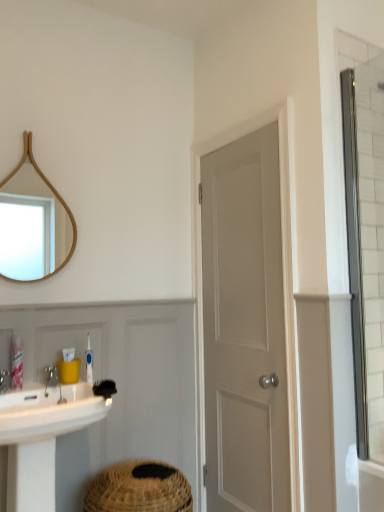
The width and height of the screenshot is (384, 512). What are the coordinates of `silver metallic faucet at lower left` in the screenshot? It's located at (5, 381).

What is the approximate height of black bristle brush at lower center?

The height of black bristle brush at lower center is 1.55 inches.

How much space does yellow plastic container at sink, which is counted as the second toiletry, starting from the right, occupy vertically?

5.85 inches.

Where is `clear glass shower door at right`? The height and width of the screenshot is (512, 384). clear glass shower door at right is located at coordinates (355, 258).

Image resolution: width=384 pixels, height=512 pixels. Describe the element at coordinates (89, 362) in the screenshot. I see `blue plastic toothbrush at lower left, acting as the first toiletry starting from the right` at that location.

The image size is (384, 512). I want to click on silver metallic faucet at lower left, so [5, 381].

Which of these two, wooden mirror at upper left or silver metallic faucet at lower left, is bigger?

With larger size is wooden mirror at upper left.

Which object is wider, wooden mirror at upper left or silver metallic faucet at lower left?

silver metallic faucet at lower left.

Is wooden mirror at upper left surrounding silver metallic faucet at lower left?

No, silver metallic faucet at lower left is not inside wooden mirror at upper left.

How different are the orientations of wooden mirror at upper left and silver metallic faucet at lower left in degrees?

The facing directions of wooden mirror at upper left and silver metallic faucet at lower left are 0.404 degrees apart.

Would you say black bristle brush at lower center is a long distance from white glossy sink at lower left?

No, black bristle brush at lower center is not far away from white glossy sink at lower left.

From the image's perspective, is black bristle brush at lower center above white glossy sink at lower left?

Correct, black bristle brush at lower center appears higher than white glossy sink at lower left in the image.

From the picture: Is white glossy sink at lower left completely or partially inside black bristle brush at lower center?

No, white glossy sink at lower left is not surrounded by black bristle brush at lower center.

Are pink plastic tube at lower left, which is the 1th toiletry from left to right, and blue plastic toothbrush at lower left, acting as the first toiletry starting from the right, beside each other?

Answer: pink plastic tube at lower left, which is the 1th toiletry from left to right, and blue plastic toothbrush at lower left, acting as the first toiletry starting from the right, are not in contact.

Which object is positioned more to the left, pink plastic tube at lower left, positioned as the third toiletry in right-to-left order, or blue plastic toothbrush at lower left, acting as the third toiletry starting from the left?

From the viewer's perspective, pink plastic tube at lower left, positioned as the third toiletry in right-to-left order, appears more on the left side.

From a real-world perspective, is pink plastic tube at lower left, which is the 1th toiletry from left to right, physically below blue plastic toothbrush at lower left, acting as the third toiletry starting from the left?

Yes.

What's the angular difference between pink plastic tube at lower left, which is the 1th toiletry from left to right, and clear glass shower door at right's facing directions?

The angular difference between pink plastic tube at lower left, which is the 1th toiletry from left to right, and clear glass shower door at right is 90 degrees.

How far apart are pink plastic tube at lower left, positioned as the third toiletry in right-to-left order, and clear glass shower door at right?

pink plastic tube at lower left, positioned as the third toiletry in right-to-left order, and clear glass shower door at right are 1.44 meters apart from each other.

From the image's perspective, which object appears higher, pink plastic tube at lower left, which is the 1th toiletry from left to right, or clear glass shower door at right?

clear glass shower door at right is shown above in the image.

Is pink plastic tube at lower left, positioned as the third toiletry in right-to-left order, facing towards clear glass shower door at right?

No, pink plastic tube at lower left, positioned as the third toiletry in right-to-left order, is not oriented towards clear glass shower door at right.

From the image's perspective, is white glossy sink at lower left on top of yellow plastic container at sink, which is counted as the second toiletry, starting from the right?

Actually, white glossy sink at lower left appears below yellow plastic container at sink, which is counted as the second toiletry, starting from the right, in the image.

How distant is white glossy sink at lower left from yellow plastic container at sink, which is counted as the second toiletry, starting from the right?

white glossy sink at lower left and yellow plastic container at sink, which is counted as the second toiletry, starting from the right, are 11.58 inches apart from each other.

From a real-world perspective, is white glossy sink at lower left positioned above or below yellow plastic container at sink, which is counted as the second toiletry, starting from the right?

Clearly, from a real-world perspective, white glossy sink at lower left is below yellow plastic container at sink, which is counted as the second toiletry, starting from the right.

Are white glossy sink at lower left and yellow plastic container at sink, the 2th toiletry from the left, far apart?

They are positioned close to each other.

Does point (170, 466) come behind point (14, 480)?

Yes, it is.

Does brown woven basket at lower center have a lesser height compared to white glossy sink at lower left?

Yes, brown woven basket at lower center is shorter than white glossy sink at lower left.

Is brown woven basket at lower center positioned beyond the bounds of white glossy sink at lower left?

Yes, brown woven basket at lower center is located beyond the bounds of white glossy sink at lower left.

Is brown woven basket at lower center oriented towards white glossy sink at lower left?

No.

Is black bristle brush at lower center not inside white matte door at center?

Indeed, black bristle brush at lower center is completely outside white matte door at center.

What's the angular difference between black bristle brush at lower center and white matte door at center's facing directions?

75.7 degrees.

Could you tell me if black bristle brush at lower center is turned towards white matte door at center?

No.

Does black bristle brush at lower center have a greater height compared to white matte door at center?

No.

Locate an element on the screen. The width and height of the screenshot is (384, 512). mirror above the silver metallic faucet at lower left (from the image's perspective) is located at coordinates (54, 207).

This screenshot has height=512, width=384. What are the coordinates of `brush above the white glossy sink at lower left (from a real-world perspective)` in the screenshot? It's located at (104, 388).

From the image, which object appears to be nearer to black bristle brush at lower center, silver metallic faucet at lower left or brown woven basket at lower center?

silver metallic faucet at lower left is closer to black bristle brush at lower center.

When comparing their distances from black bristle brush at lower center, does yellow plastic container at sink, the 2th toiletry from the left, or silver metallic faucet at lower left seem closer?

Based on the image, yellow plastic container at sink, the 2th toiletry from the left, appears to be nearer to black bristle brush at lower center.

From the image, which object appears to be nearer to black bristle brush at lower center, blue plastic toothbrush at lower left, acting as the third toiletry starting from the left, or yellow plastic container at sink, which is counted as the second toiletry, starting from the right?

yellow plastic container at sink, which is counted as the second toiletry, starting from the right, is closer to black bristle brush at lower center.

From the image, which object appears to be nearer to white matte door at center, blue plastic toothbrush at lower left, acting as the third toiletry starting from the left, or silver metallic faucet at lower left?

Based on the image, blue plastic toothbrush at lower left, acting as the third toiletry starting from the left, appears to be nearer to white matte door at center.

Looking at the image, which one is located closer to white matte door at center, clear glass shower door at right or black bristle brush at lower center?

Based on the image, clear glass shower door at right appears to be nearer to white matte door at center.

When comparing their distances from white matte door at center, does clear glass shower door at right or blue plastic toothbrush at lower left, acting as the third toiletry starting from the left, seem further?

blue plastic toothbrush at lower left, acting as the third toiletry starting from the left, is further to white matte door at center.

Based on their spatial positions, is black bristle brush at lower center or blue plastic toothbrush at lower left, acting as the third toiletry starting from the left, closer to white glossy sink at lower left?

Based on the image, black bristle brush at lower center appears to be nearer to white glossy sink at lower left.

From the image, which object appears to be nearer to silver metallic faucet at lower left, brown woven basket at lower center or yellow plastic container at sink, which is counted as the second toiletry, starting from the right?

Among the two, yellow plastic container at sink, which is counted as the second toiletry, starting from the right, is located nearer to silver metallic faucet at lower left.

I want to click on brush situated between silver metallic faucet at lower left and white matte door at center from left to right, so click(104, 388).

Image resolution: width=384 pixels, height=512 pixels. I want to click on tap that lies between blue plastic toothbrush at lower left, acting as the third toiletry starting from the left, and brown woven basket at lower center from top to bottom, so click(5, 381).

Locate an element on the screen. This screenshot has width=384, height=512. basket between silver metallic faucet at lower left and white matte door at center is located at coordinates (139, 489).

What are the coordinates of `brush between white glossy sink at lower left and blue plastic toothbrush at lower left, acting as the first toiletry starting from the right, in the front-back direction` in the screenshot? It's located at (104, 388).